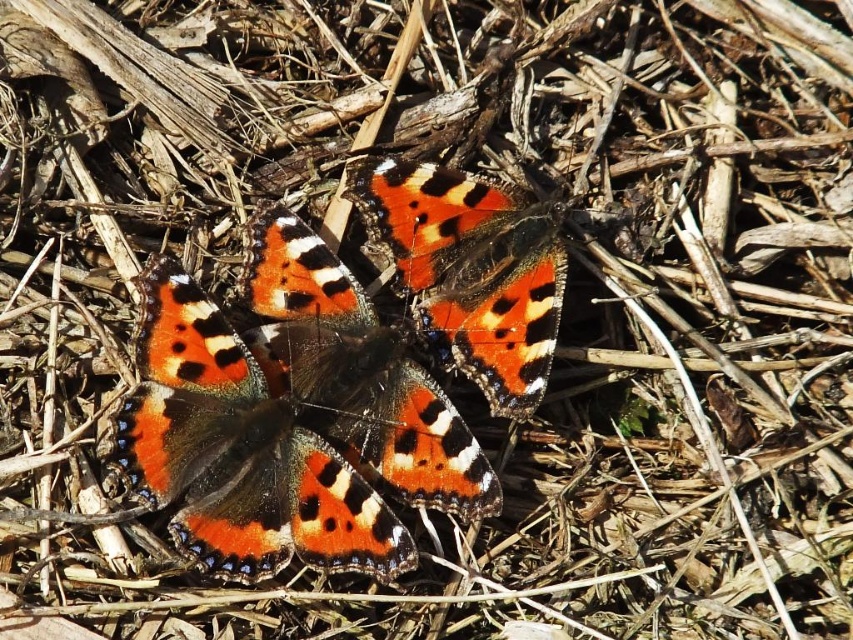
Question: Which object appears closest to the camera in this image?

Choices:
 (A) orange-patterned wings at center
 (B) orange-patterned wing at center

Answer: (A)

Question: Estimate the real-world distances between objects in this image. Which object is farther from the orange-patterned wings at center?

Choices:
 (A) orange-patterned wing at center
 (B) shiny orange butterfly at center

Answer: (B)

Question: Is orange-patterned wings at center in front of orange-patterned wing at center?

Choices:
 (A) no
 (B) yes

Answer: (B)

Question: Considering the real-world distances, which object is farthest from the orange-patterned wing at center?

Choices:
 (A) orange-patterned wings at center
 (B) shiny orange butterfly at center

Answer: (B)

Question: Can you confirm if orange-patterned wings at center is bigger than shiny orange butterfly at center?

Choices:
 (A) no
 (B) yes

Answer: (B)

Question: From the image, what is the correct spatial relationship of orange-patterned wings at center in relation to shiny orange butterfly at center?

Choices:
 (A) right
 (B) left

Answer: (B)